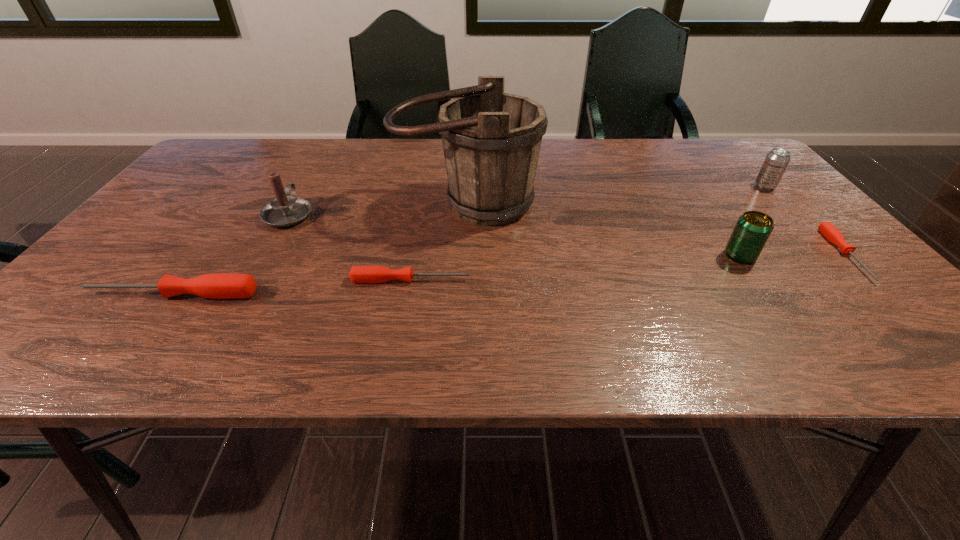
The width and height of the screenshot is (960, 540). Identify the location of the nearer beer can. (752, 230).

The height and width of the screenshot is (540, 960). What are the coordinates of `free space located 0.150m at the tip of the second screwdriver from right to left` in the screenshot? It's located at (540, 280).

I want to click on vacant space located 0.100m at the tip of the shortest object, so click(910, 321).

Find the location of a particular element. The image size is (960, 540). vacant region located 0.330m on the side of the second tallest object with the handle loop is located at coordinates (329, 144).

Locate an element on the screen. The height and width of the screenshot is (540, 960). free space located on the side of the second tallest object with the handle loop is located at coordinates (332, 139).

This screenshot has width=960, height=540. Find the location of `vacant space situated 0.210m on the side of the second tallest object with the handle loop`. vacant space situated 0.210m on the side of the second tallest object with the handle loop is located at coordinates (319, 162).

The width and height of the screenshot is (960, 540). Identify the location of vacant position located on the front of the right beer can. (825, 251).

What are the coordinates of `free space located 0.230m on the handle side of the tallest object` in the screenshot? It's located at (463, 301).

The width and height of the screenshot is (960, 540). In order to click on free point located 0.290m on the left of the left beer can in this screenshot , I will do `click(596, 256)`.

You are a GUI agent. You are given a task and a screenshot of the screen. Output one action in this format:
    pyautogui.click(x=<x>, y=<y>)
    Task: Click on the object located at the near edge
    The image size is (960, 540).
    Given the screenshot: What is the action you would take?
    pyautogui.click(x=218, y=286)